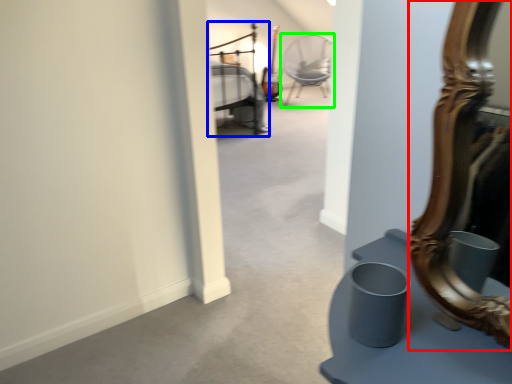
Question: Considering the real-world distances, which object is closest to mirror (highlighted by a red box)? bed (highlighted by a blue box) or chair (highlighted by a green box).

Choices:
 (A) bed
 (B) chair

Answer: (A)